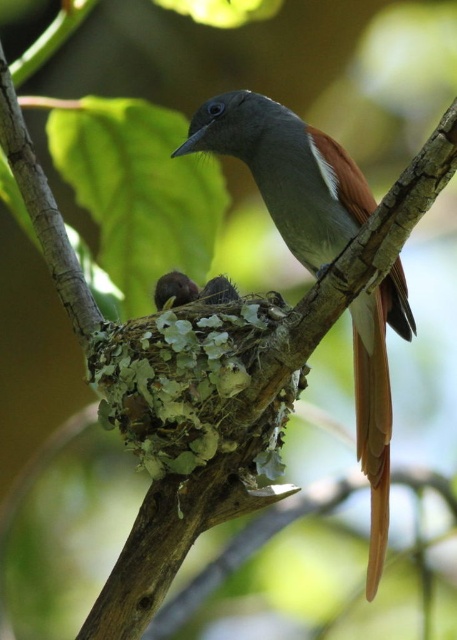
Is brown glossy bird at center to the left of brown feathered nest at center from the viewer's perspective?

In fact, brown glossy bird at center is to the right of brown feathered nest at center.

Which is more to the right, brown glossy bird at center or brown feathered nest at center?

brown glossy bird at center

Between point (339, 182) and point (100, 358), which one is positioned in front?

Point (100, 358) is in front.

Locate an element on the screen. brown glossy bird at center is located at coordinates (287, 172).